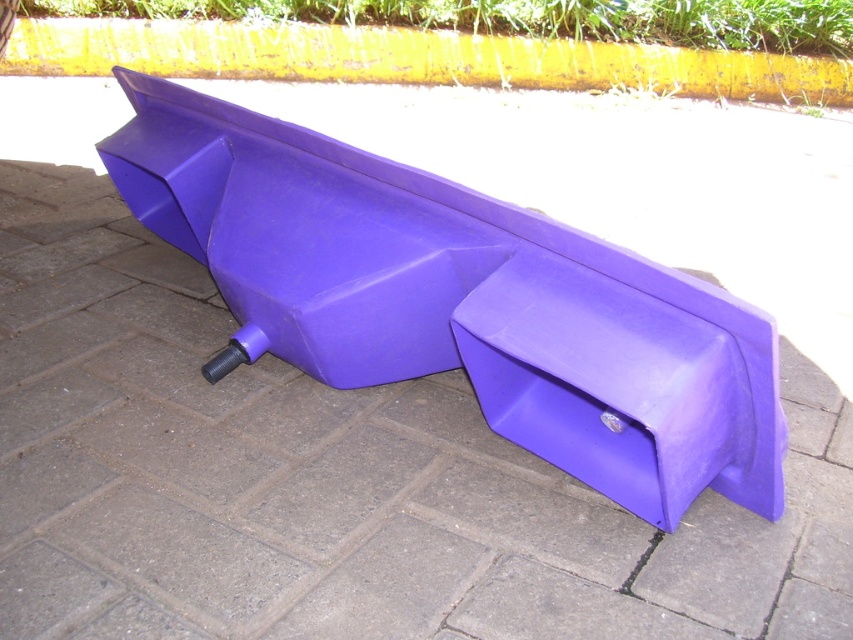
Is matte purple handcart at center to the left of yellow painted curb at upper center from the viewer's perspective?

Correct, you'll find matte purple handcart at center to the left of yellow painted curb at upper center.

Consider the image. Does matte purple handcart at center have a greater height compared to yellow painted curb at upper center?

Yes.

Measure the distance between point (157, 83) and camera.

The distance of point (157, 83) from camera is 5.13 feet.

The image size is (853, 640). Identify the location of matte purple handcart at center. (461, 300).